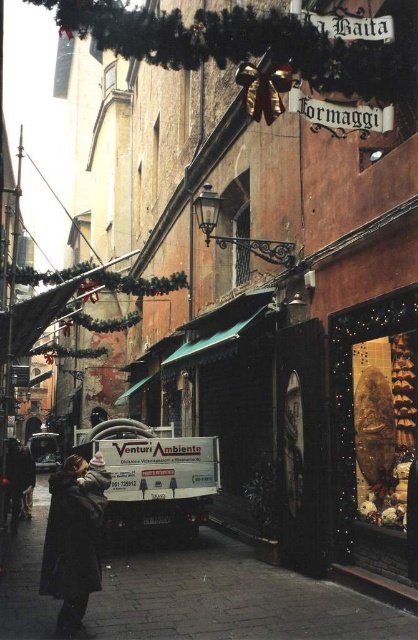
Does white matte van at center come in front of dark brown coat at lower left?

No, white matte van at center is behind dark brown coat at lower left.

From the picture: Between white matte van at center and dark brown coat at lower left, which one has less height?

white matte van at center is shorter.

Where is `white matte van at center`? The height and width of the screenshot is (640, 418). white matte van at center is located at coordinates (x=231, y=600).